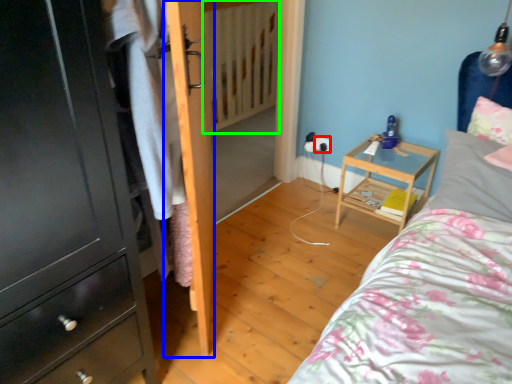
Question: Which is nearer to the electric outlet (highlighted by a red box)? door (highlighted by a blue box) or radiator (highlighted by a green box).

Choices:
 (A) door
 (B) radiator

Answer: (B)